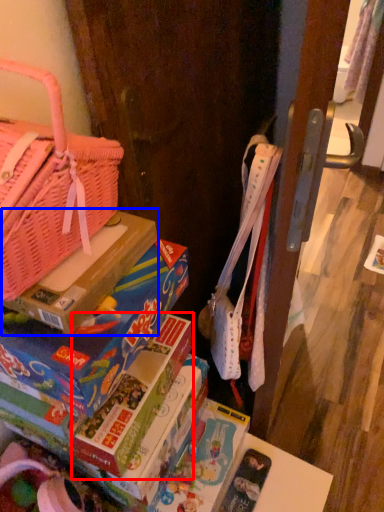
Question: Which object is further to the camera taking this photo, paperback book (highlighted by a red box) or cardboard box (highlighted by a blue box)?

Choices:
 (A) paperback book
 (B) cardboard box

Answer: (A)